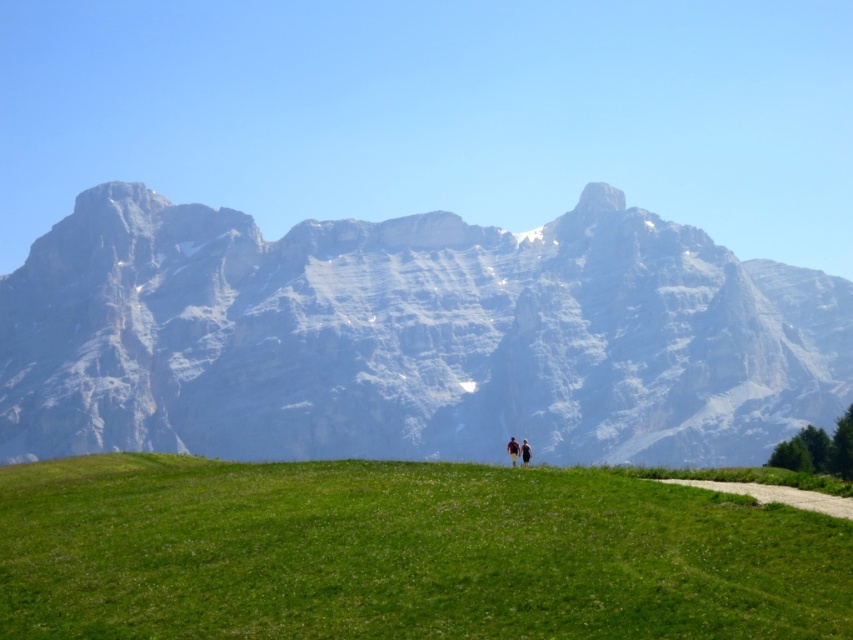
Question: Which is farther from the gray rocky mountain range at upper center?

Choices:
 (A) light brown fabric person at center
 (B) green grassy hill at lower center
 (C) dark brown leather jacket at center
 (D) red fabric couple at center

Answer: (B)

Question: Is gray rocky mountain range at upper center thinner than green grassy hill at lower center?

Choices:
 (A) no
 (B) yes

Answer: (A)

Question: Which point appears farthest from the camera in this image?

Choices:
 (A) (527, 458)
 (B) (517, 454)
 (C) (223, 312)
 (D) (280, 538)

Answer: (C)

Question: Is gray rocky mountain range at upper center smaller than green grassy hill at lower center?

Choices:
 (A) yes
 (B) no

Answer: (B)

Question: Which object appears farthest from the camera in this image?

Choices:
 (A) green grassy hill at lower center
 (B) dark brown leather jacket at center

Answer: (B)

Question: Is gray rocky mountain range at upper center positioned behind dark brown leather jacket at center?

Choices:
 (A) yes
 (B) no

Answer: (A)